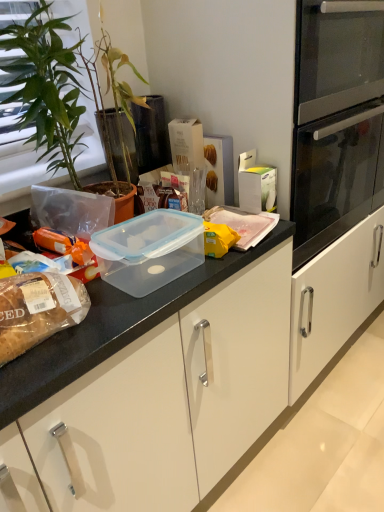
Question: From the image's perspective, is transparent plastic container at center beneath translucent plastic container at center, the second food ordered from the bottom?

Choices:
 (A) no
 (B) yes

Answer: (B)

Question: Considering the relative sizes of transparent plastic container at center and translucent plastic container at center, which is the second food from front to back, in the image provided, is transparent plastic container at center bigger than translucent plastic container at center, which is the second food from front to back,?

Choices:
 (A) no
 (B) yes

Answer: (B)

Question: Is transparent plastic container at center taller than translucent plastic container at center, which is the second food from front to back?

Choices:
 (A) yes
 (B) no

Answer: (A)

Question: Can you confirm if transparent plastic container at center is smaller than translucent plastic container at center, the second food ordered from the bottom?

Choices:
 (A) yes
 (B) no

Answer: (B)

Question: Is transparent plastic container at center directly adjacent to translucent plastic container at center, the first food when ordered from right to left?

Choices:
 (A) yes
 (B) no

Answer: (B)

Question: Based on their sizes in the image, would you say translucent plastic bread at left, the second food positioned from the top, is bigger or smaller than transparent plastic container at center?

Choices:
 (A) small
 (B) big

Answer: (A)

Question: Is translucent plastic bread at left, the second food from the right, situated inside transparent plastic container at center or outside?

Choices:
 (A) inside
 (B) outside

Answer: (B)

Question: Based on their positions, is translucent plastic bread at left, the first food from the bottom, located to the left or right of transparent plastic container at center?

Choices:
 (A) left
 (B) right

Answer: (A)

Question: Considering the positions of point (64, 314) and point (107, 261), is point (64, 314) closer or farther from the camera than point (107, 261)?

Choices:
 (A) farther
 (B) closer

Answer: (B)

Question: From the image's perspective, is translucent plastic container at center, which is the second food from front to back, above or below green leafy plant at left?

Choices:
 (A) above
 (B) below

Answer: (B)

Question: Is point (241, 247) positioned closer to the camera than point (29, 118)?

Choices:
 (A) closer
 (B) farther

Answer: (B)

Question: Considering the positions of translucent plastic container at center, the 1th food when ordered from top to bottom, and green leafy plant at left in the image, is translucent plastic container at center, the 1th food when ordered from top to bottom, taller or shorter than green leafy plant at left?

Choices:
 (A) tall
 (B) short

Answer: (B)

Question: Based on their positions, is translucent plastic container at center, the second food ordered from the bottom, located to the left or right of green leafy plant at left?

Choices:
 (A) left
 (B) right

Answer: (B)

Question: Visually, is translucent plastic container at center, the 1th food when ordered from top to bottom, positioned to the left or to the right of transparent plastic container at center?

Choices:
 (A) right
 (B) left

Answer: (A)

Question: From the image's perspective, is translucent plastic container at center, which appears as the 2th food when viewed from the left, above or below transparent plastic container at center?

Choices:
 (A) below
 (B) above

Answer: (B)